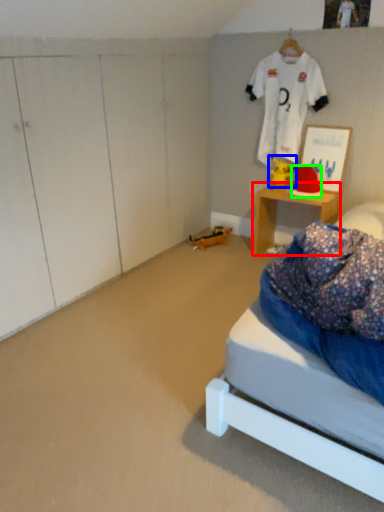
Question: Estimate the real-world distances between objects in this image. Which object is closer to desk (highlighted by a red box), toy (highlighted by a blue box) or hat (highlighted by a green box)?

Choices:
 (A) toy
 (B) hat

Answer: (B)